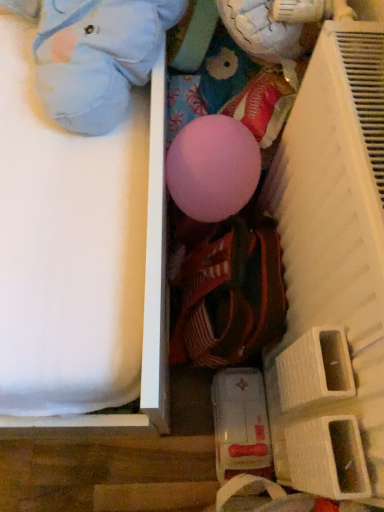
What is the approximate height of light blue plush toy at upper left?

light blue plush toy at upper left is 20.39 centimeters in height.

In order to face light blue plush toy at upper left, should I rotate leftwards or rightwards?

Turn left approximately 15.996 degrees to face it.

Describe the element at coordinates (95, 55) in the screenshot. I see `light blue plush toy at upper left` at that location.

The height and width of the screenshot is (512, 384). What are the coordinates of `light blue plush toy at upper left` in the screenshot? It's located at (95, 55).

The width and height of the screenshot is (384, 512). In order to click on white plastic shelf at right in this screenshot , I will do `click(332, 272)`.

The image size is (384, 512). Describe the element at coordinates (332, 272) in the screenshot. I see `white plastic shelf at right` at that location.

I want to click on light blue plush toy at upper left, so click(x=95, y=55).

Which is more to the left, white plastic shelf at right or light blue plush toy at upper left?

Positioned to the left is light blue plush toy at upper left.

Which is behind, white plastic shelf at right or light blue plush toy at upper left?

light blue plush toy at upper left is more distant.

Is point (376, 154) more distant than point (90, 42)?

No, it is not.

From the image's perspective, who appears lower, white plastic shelf at right or light blue plush toy at upper left?

white plastic shelf at right appears lower in the image.

From a real-world perspective, does white plastic shelf at right sit lower than light blue plush toy at upper left?

Yes, from a real-world perspective, white plastic shelf at right is under light blue plush toy at upper left.

Is white plastic shelf at right wider than light blue plush toy at upper left?

In fact, white plastic shelf at right might be narrower than light blue plush toy at upper left.

Who is taller, white plastic shelf at right or light blue plush toy at upper left?

white plastic shelf at right.

Does white plastic shelf at right have a larger size compared to light blue plush toy at upper left?

Yes.

Would you say white plastic shelf at right is inside or outside light blue plush toy at upper left?

white plastic shelf at right is spatially situated outside light blue plush toy at upper left.

Are white plastic shelf at right and light blue plush toy at upper left beside each other?

No, white plastic shelf at right is not beside light blue plush toy at upper left.

Is white plastic shelf at right facing away from light blue plush toy at upper left?

No, white plastic shelf at right is not facing the opposite direction of light blue plush toy at upper left.

You are a GUI agent. You are given a task and a screenshot of the screen. Output one action in this format:
    pyautogui.click(x=<x>, y=<y>)
    Task: Click on the shelf in front of the light blue plush toy at upper left
    
    Given the screenshot: What is the action you would take?
    pyautogui.click(x=332, y=272)

Does light blue plush toy at upper left appear on the right side of white plastic shelf at right?

No.

Between light blue plush toy at upper left and white plastic shelf at right, which one is positioned in front?

Positioned in front is white plastic shelf at right.

Is point (149, 68) positioned in front of point (356, 175)?

No, (149, 68) is behind (356, 175).

From the image's perspective, which object appears higher, light blue plush toy at upper left or white plastic shelf at right?

From the image's view, light blue plush toy at upper left is above.

From a real-world perspective, is light blue plush toy at upper left positioned above or below white plastic shelf at right?

light blue plush toy at upper left is above white plastic shelf at right.

Considering the sizes of objects light blue plush toy at upper left and white plastic shelf at right in the image provided, who is thinner, light blue plush toy at upper left or white plastic shelf at right?

Thinner between the two is white plastic shelf at right.

Considering the relative sizes of light blue plush toy at upper left and white plastic shelf at right in the image provided, is light blue plush toy at upper left shorter than white plastic shelf at right?

Yes, light blue plush toy at upper left is shorter than white plastic shelf at right.

Considering the sizes of objects light blue plush toy at upper left and white plastic shelf at right in the image provided, who is bigger, light blue plush toy at upper left or white plastic shelf at right?

white plastic shelf at right.

Does light blue plush toy at upper left contain white plastic shelf at right?

No, white plastic shelf at right is not surrounded by light blue plush toy at upper left.

Is light blue plush toy at upper left in contact with white plastic shelf at right?

No, light blue plush toy at upper left is not next to white plastic shelf at right.

Is light blue plush toy at upper left facing away from white plastic shelf at right?

No, white plastic shelf at right is not at the back of light blue plush toy at upper left.

I want to click on toy located on the left of white plastic shelf at right, so click(95, 55).

At what (x,y) coordinates should I click in order to perform the action: click on shelf in front of the light blue plush toy at upper left. Please return your answer as a coordinate pair (x, y). The height and width of the screenshot is (512, 384). Looking at the image, I should click on (332, 272).

Where is `toy that is above the white plastic shelf at right (from the image's perspective)`? This screenshot has width=384, height=512. toy that is above the white plastic shelf at right (from the image's perspective) is located at coordinates (95, 55).